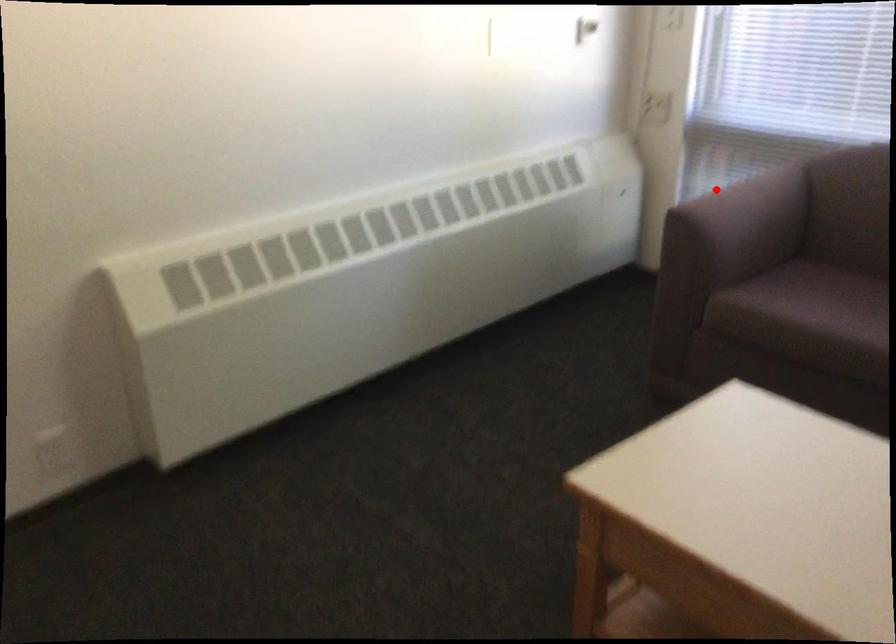
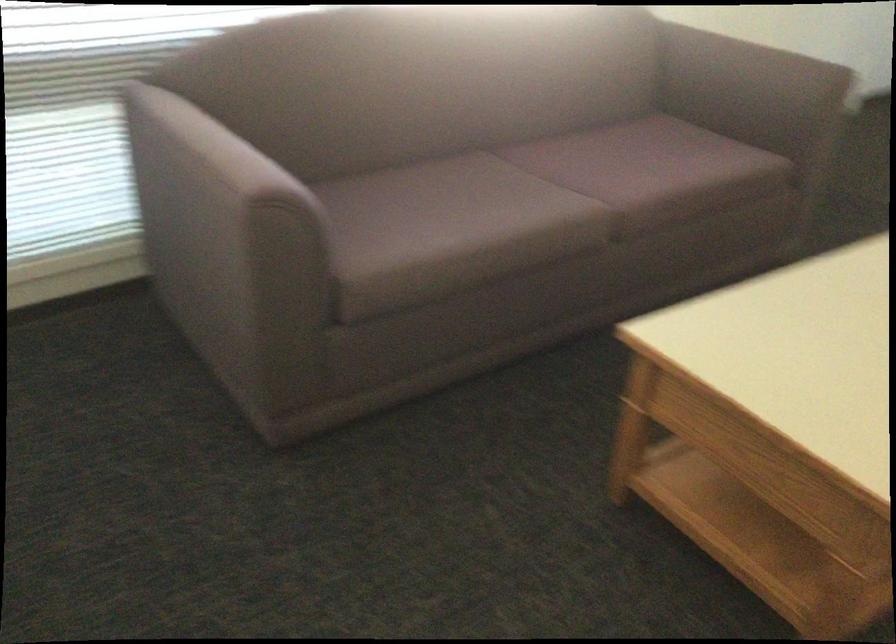
Question: I am providing you with two images of the same scene from different viewpoints. Given a red point in image1, look at the same physical point in image2. Is it:

Choices:
 (A) Closer to the viewpoint
 (B) Farther from the viewpoint

Answer: (A)